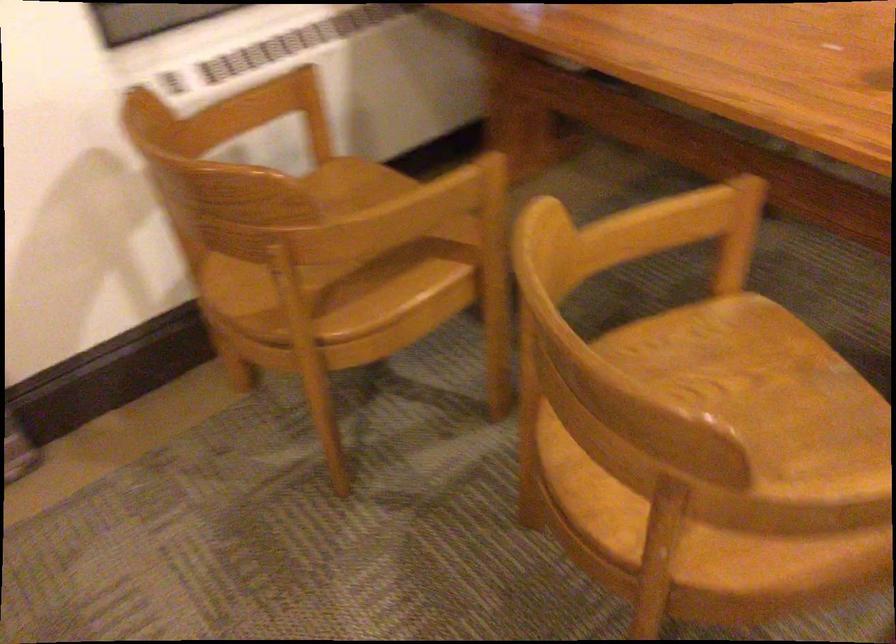
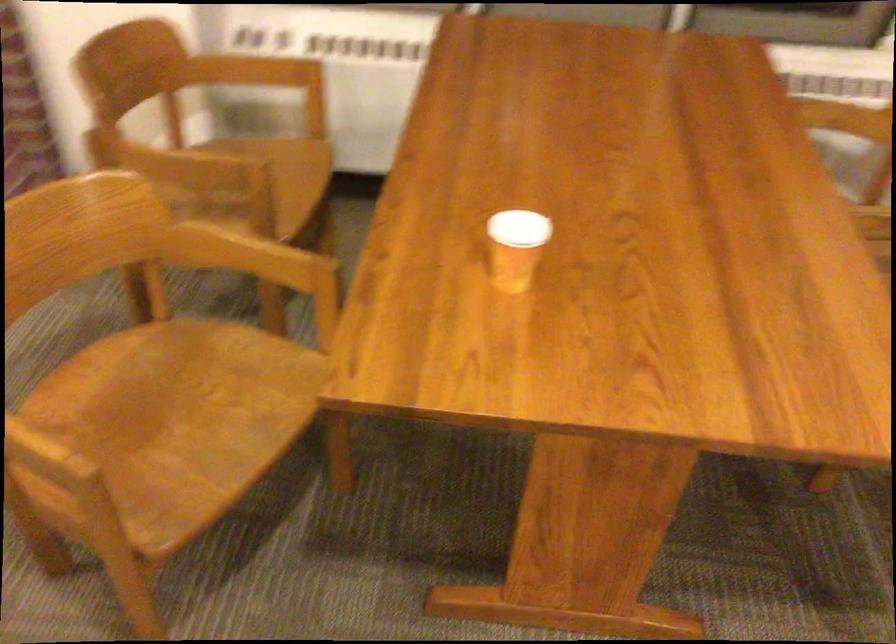
Find the pixel in the second image that matches (771,422) in the first image.

(170, 424)